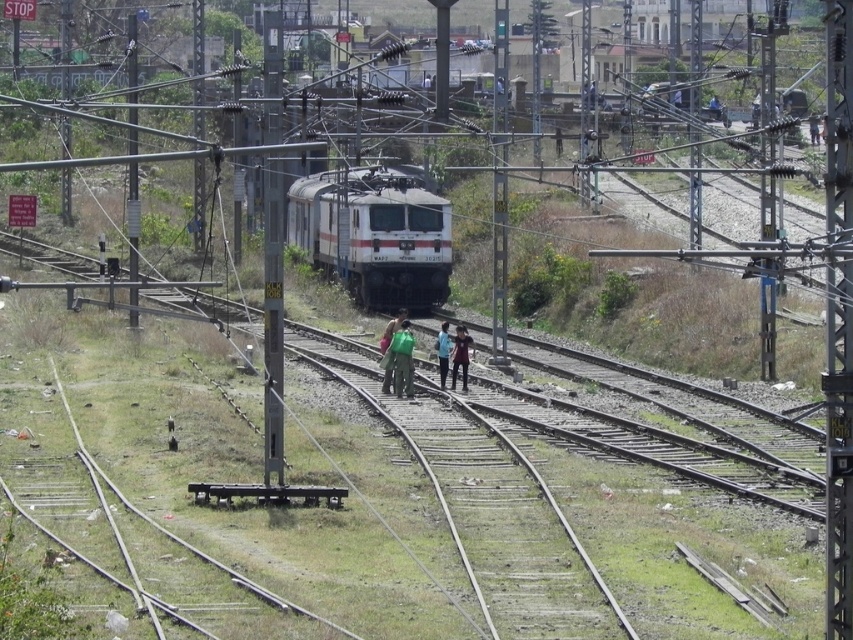
Is green fabric at center wider than blue fabric shirt at center?

Indeed, green fabric at center has a greater width compared to blue fabric shirt at center.

Measure the distance from green fabric at center to blue fabric shirt at center.

green fabric at center is 3.57 meters away from blue fabric shirt at center.

You are a GUI agent. You are given a task and a screenshot of the screen. Output one action in this format:
    pyautogui.click(x=<x>, y=<y>)
    Task: Click on the green fabric at center
    
    Given the screenshot: What is the action you would take?
    pyautogui.click(x=387, y=348)

Is point (402, 353) positioned after point (444, 349)?

That is False.

How distant is green fabric bag at center from blue fabric shirt at center?

green fabric bag at center and blue fabric shirt at center are 1.84 meters apart from each other.

You are a GUI agent. You are given a task and a screenshot of the screen. Output one action in this format:
    pyautogui.click(x=<x>, y=<y>)
    Task: Click on the green fabric bag at center
    Image resolution: width=853 pixels, height=640 pixels.
    Given the screenshot: What is the action you would take?
    click(x=402, y=358)

Can you confirm if green fabric bag at center is positioned above green fabric at center?

No, green fabric bag at center is not above green fabric at center.

Does green fabric bag at center lie behind green fabric at center?

No, it is not.

At what (x,y) coordinates should I click in order to perform the action: click on green fabric bag at center. Please return your answer as a coordinate pair (x, y). Looking at the image, I should click on (402, 358).

Where is `green fabric bag at center`? The width and height of the screenshot is (853, 640). green fabric bag at center is located at coordinates (402, 358).